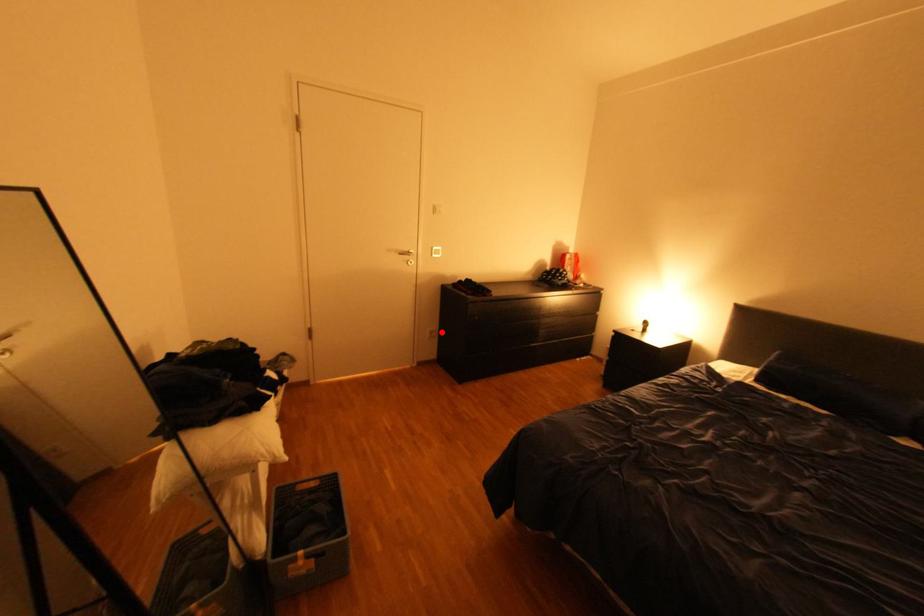
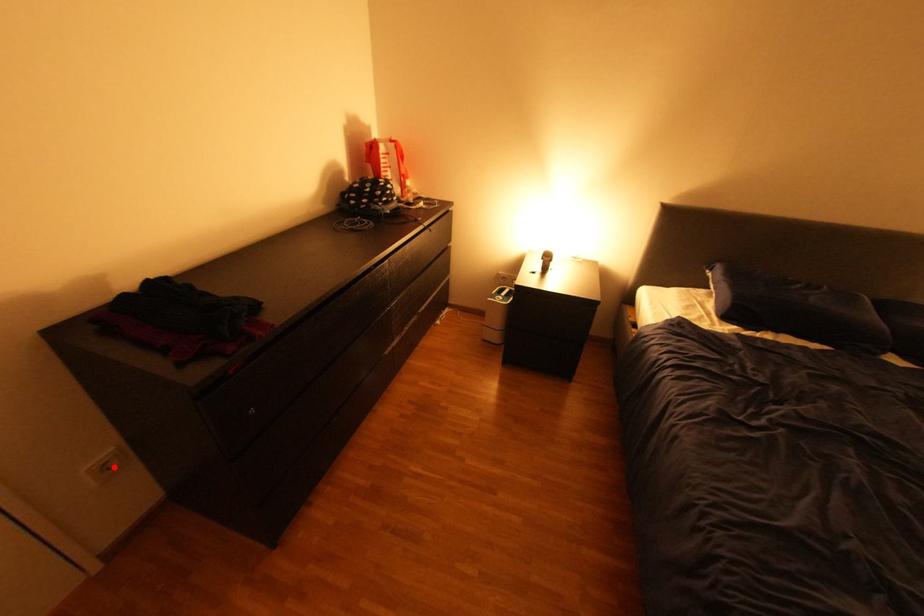
I am providing you with two images of the same scene from different viewpoints. A red point is marked on the first image and another point is marked on the second image. Are the points marked in image1 and image2 representing the same 3D position?

Yes